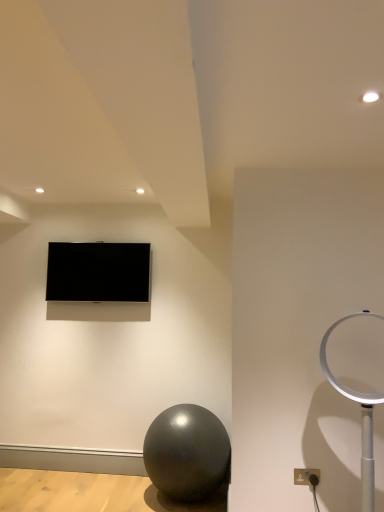
Question: Is matte black tv at upper center thinner than shiny metallic ball at lower center?

Choices:
 (A) no
 (B) yes

Answer: (B)

Question: Does matte black tv at upper center have a larger size compared to shiny metallic ball at lower center?

Choices:
 (A) yes
 (B) no

Answer: (B)

Question: Does matte black tv at upper center have a smaller size compared to shiny metallic ball at lower center?

Choices:
 (A) no
 (B) yes

Answer: (B)

Question: From a real-world perspective, is matte black tv at upper center located beneath shiny metallic ball at lower center?

Choices:
 (A) yes
 (B) no

Answer: (B)

Question: Is matte black tv at upper center with shiny metallic ball at lower center?

Choices:
 (A) yes
 (B) no

Answer: (B)

Question: Is there a large distance between matte black tv at upper center and shiny metallic ball at lower center?

Choices:
 (A) no
 (B) yes

Answer: (B)

Question: Does white plastic table lamp at right have a lesser height compared to shiny metallic ball at lower center?

Choices:
 (A) yes
 (B) no

Answer: (B)

Question: Does white plastic table lamp at right have a greater height compared to shiny metallic ball at lower center?

Choices:
 (A) yes
 (B) no

Answer: (A)

Question: From the image's perspective, would you say white plastic table lamp at right is shown under shiny metallic ball at lower center?

Choices:
 (A) no
 (B) yes

Answer: (A)

Question: Is white plastic table lamp at right directly adjacent to shiny metallic ball at lower center?

Choices:
 (A) yes
 (B) no

Answer: (B)

Question: Considering the relative positions of white plastic table lamp at right and shiny metallic ball at lower center in the image provided, is white plastic table lamp at right to the left of shiny metallic ball at lower center from the viewer's perspective?

Choices:
 (A) yes
 (B) no

Answer: (B)

Question: Does white plastic table lamp at right come behind shiny metallic ball at lower center?

Choices:
 (A) no
 (B) yes

Answer: (A)

Question: Does matte gray outlet at lower right lie behind shiny metallic ball at lower center?

Choices:
 (A) no
 (B) yes

Answer: (A)